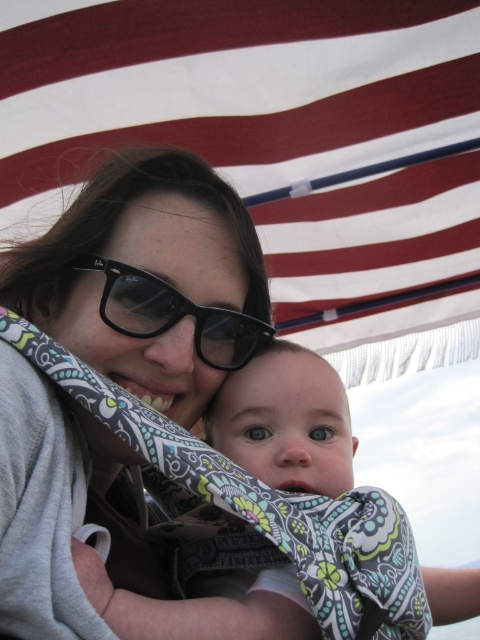
You are a photographer trying to capture a closeup of the baby while ensuring the American flag is visible in the background. Given the positions of the white striped fabric at upper center and the black plastic glasses at center, which object should you focus on first to frame the shot properly?

The black plastic glasses at center should be focused on first since the white striped fabric at upper center is to the right of it, allowing you to position the baby and flag appropriately.

You are a photographer trying to capture a closeup of the woman and the baby. You notice two points in the image at coordinates point [358,44] and point [118,289]. Which point is closer to the camera?

Point [358,44] is further to the camera than point [118,289]. Therefore, point [118,289] is closer to the camera.

You are a photographer trying to capture a closeup of the matte black sunglasses at center and the black plastic glasses at center. Which object should you focus on first to ensure it appears sharp in the photo?

You should focus on the matte black sunglasses at center first because it is closer to the viewer than the black plastic glasses at center, so adjusting focus from near to far will help capture both objects clearly.